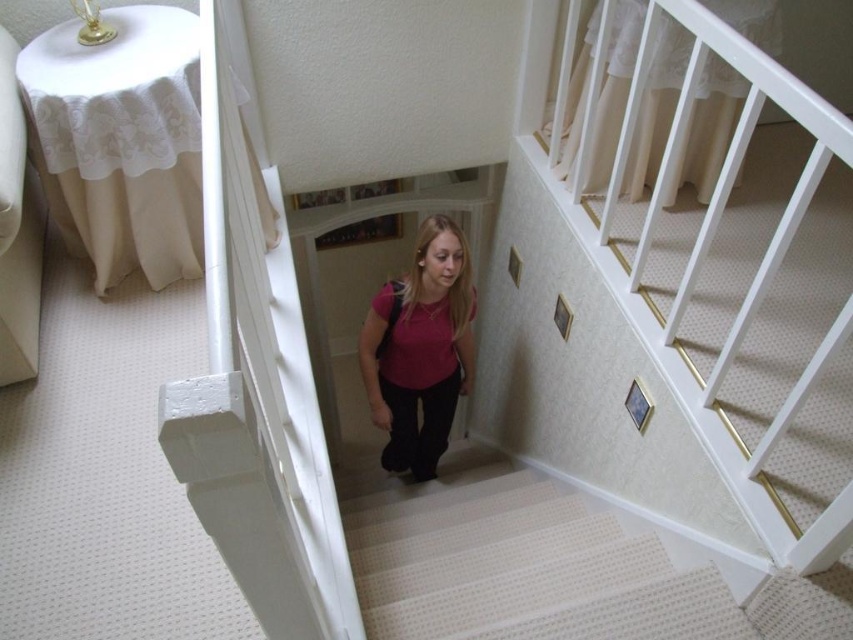
Based on the photo, you are standing at the top of the staircase and see the white textured carpet at center and the matte pink shirt at center. Which object is located lower in the scene?

The white textured carpet at center is located below the matte pink shirt at center, so the white textured carpet at center is lower in the scene.

You are a delivery person who needs to place a large package on the floor. The floor has the white textured carpet at center and the matte pink shirt at center. Which surface can accommodate the package without it hanging off the edge?

The white textured carpet at center has a larger size compared to matte pink shirt at center, so the package should be placed on the white textured carpet at center to ensure it fits properly without overhanging.